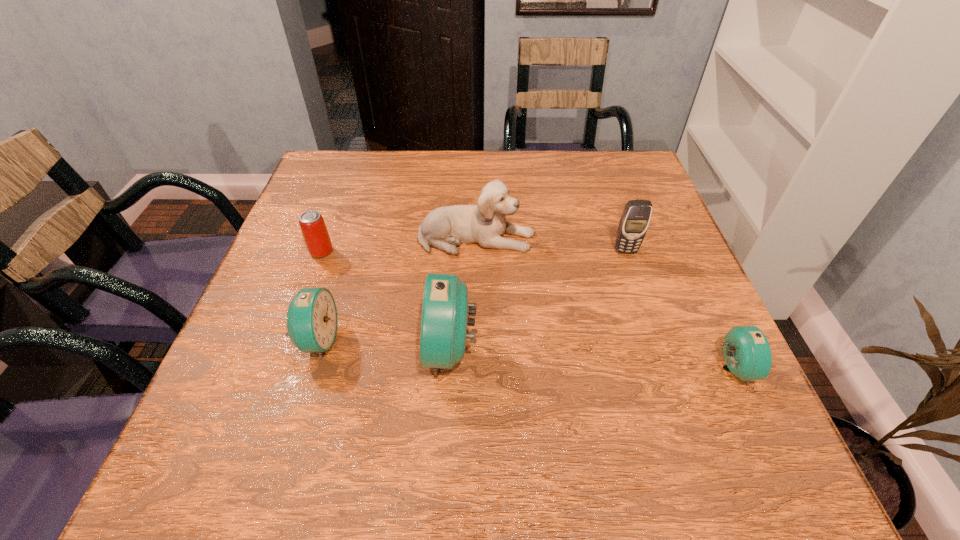
Locate an element on the screen. location for an additional alarm_clock to make spacing equal is located at coordinates (588, 359).